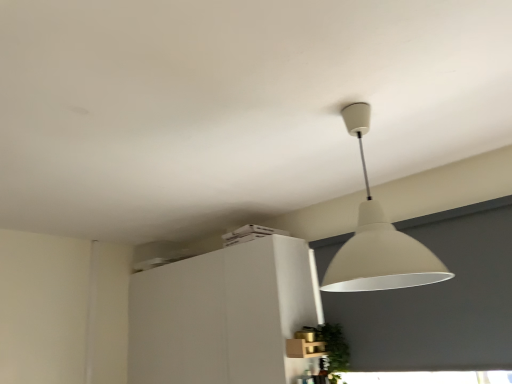
Question: Is green leafy plant at lower right next to matte white lampshade at upper center and touching it?

Choices:
 (A) no
 (B) yes

Answer: (A)

Question: Does green leafy plant at lower right have a larger size compared to matte white lampshade at upper center?

Choices:
 (A) yes
 (B) no

Answer: (B)

Question: Does green leafy plant at lower right have a lesser width compared to matte white lampshade at upper center?

Choices:
 (A) yes
 (B) no

Answer: (A)

Question: Is green leafy plant at lower right wider than matte white lampshade at upper center?

Choices:
 (A) no
 (B) yes

Answer: (A)

Question: Considering the relative positions of green leafy plant at lower right and matte white lampshade at upper center in the image provided, is green leafy plant at lower right in front of matte white lampshade at upper center?

Choices:
 (A) no
 (B) yes

Answer: (A)

Question: From a real-world perspective, relative to matte white lampshade at upper center, is white matte cabinet at upper center vertically above or below?

Choices:
 (A) below
 (B) above

Answer: (A)

Question: In terms of size, does white matte cabinet at upper center appear bigger or smaller than matte white lampshade at upper center?

Choices:
 (A) big
 (B) small

Answer: (A)

Question: From the image's perspective, is white matte cabinet at upper center located above or below matte white lampshade at upper center?

Choices:
 (A) above
 (B) below

Answer: (B)

Question: Is white matte cabinet at upper center to the left or to the right of matte white lampshade at upper center in the image?

Choices:
 (A) left
 (B) right

Answer: (A)

Question: From a real-world perspective, is matte white lampshade at upper center positioned above or below white matte cabinet at upper center?

Choices:
 (A) above
 (B) below

Answer: (A)

Question: Does point (414, 248) appear closer or farther from the camera than point (304, 296)?

Choices:
 (A) farther
 (B) closer

Answer: (B)

Question: Is matte white lampshade at upper center bigger or smaller than white matte cabinet at upper center?

Choices:
 (A) big
 (B) small

Answer: (B)

Question: Which is correct: matte white lampshade at upper center is inside white matte cabinet at upper center, or outside of it?

Choices:
 (A) inside
 (B) outside

Answer: (B)

Question: Choose the correct answer: Is green leafy plant at lower right inside white matte cabinet at upper center or outside it?

Choices:
 (A) outside
 (B) inside

Answer: (A)

Question: Based on their positions, is green leafy plant at lower right located to the left or right of white matte cabinet at upper center?

Choices:
 (A) right
 (B) left

Answer: (A)